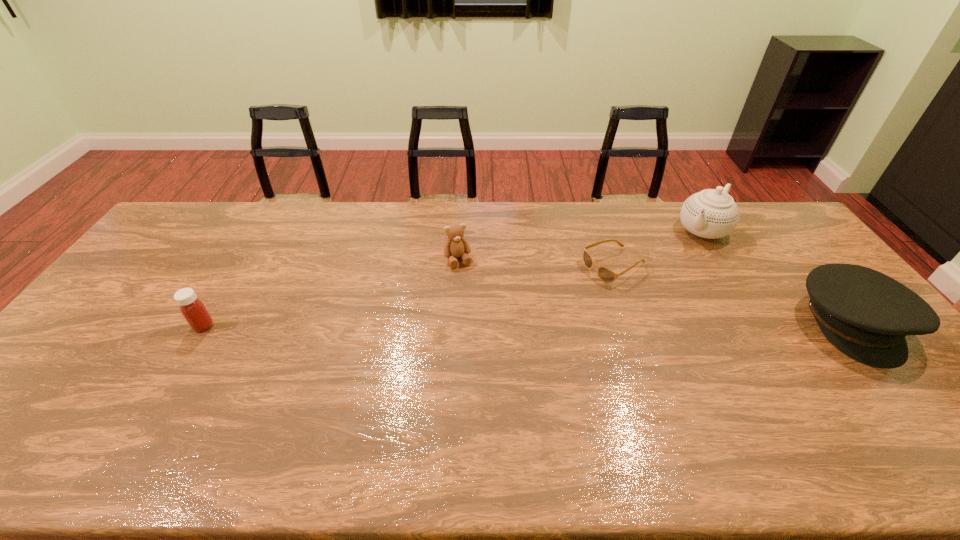
The height and width of the screenshot is (540, 960). What are the coordinates of `the leftmost object` in the screenshot? It's located at (192, 308).

Where is `beret`? The width and height of the screenshot is (960, 540). beret is located at coordinates (867, 315).

This screenshot has width=960, height=540. In order to click on sunglasses in this screenshot , I will do `click(605, 274)`.

The height and width of the screenshot is (540, 960). In order to click on the third object from left to right in this screenshot , I will do `click(605, 274)`.

In order to click on the fourth object from right to left in this screenshot , I will do `click(456, 246)`.

The image size is (960, 540). Find the location of `chinaware`. chinaware is located at coordinates (712, 213).

Where is `the farthest object`? The height and width of the screenshot is (540, 960). the farthest object is located at coordinates (712, 213).

At what (x,y) coordinates should I click in order to perform the action: click on free location located on the right of the medicine. Please return your answer as a coordinate pair (x, y). The height and width of the screenshot is (540, 960). Looking at the image, I should click on (238, 326).

The width and height of the screenshot is (960, 540). Identify the location of blank area located 0.120m on the front-facing side of the beret. (922, 411).

Image resolution: width=960 pixels, height=540 pixels. Identify the location of vacant point located on the front-facing side of the third object from left to right. click(x=568, y=288).